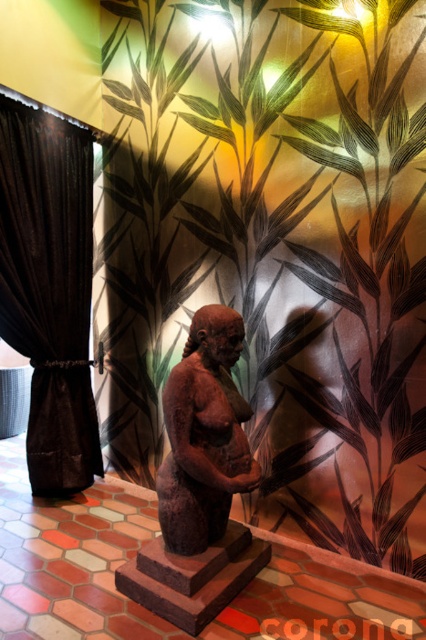
Is green leafy plant at center above brown clay figurine at center?

Indeed, green leafy plant at center is positioned over brown clay figurine at center.

Is point (284, 506) in front of point (163, 390)?

No, it is behind (163, 390).

Identify the location of green leafy plant at center. (276, 246).

Does green leafy plant at center appear under black velvet curtain at left?

Actually, green leafy plant at center is above black velvet curtain at left.

Looking at this image, which is more to the left, green leafy plant at center or black velvet curtain at left?

From the viewer's perspective, black velvet curtain at left appears more on the left side.

What do you see at coordinates (276, 246) in the screenshot? This screenshot has width=426, height=640. I see `green leafy plant at center` at bounding box center [276, 246].

The image size is (426, 640). Identify the location of green leafy plant at center. (276, 246).

Which is in front, point (46, 289) or point (219, 336)?

Point (219, 336) is more forward.

Is black velvet curtain at left to the right of brown clay figurine at center from the viewer's perspective?

Incorrect, black velvet curtain at left is not on the right side of brown clay figurine at center.

Is point (55, 403) behind point (172, 532)?

Yes, it is.

The width and height of the screenshot is (426, 640). Find the location of `black velvet curtain at left`. black velvet curtain at left is located at coordinates (49, 289).